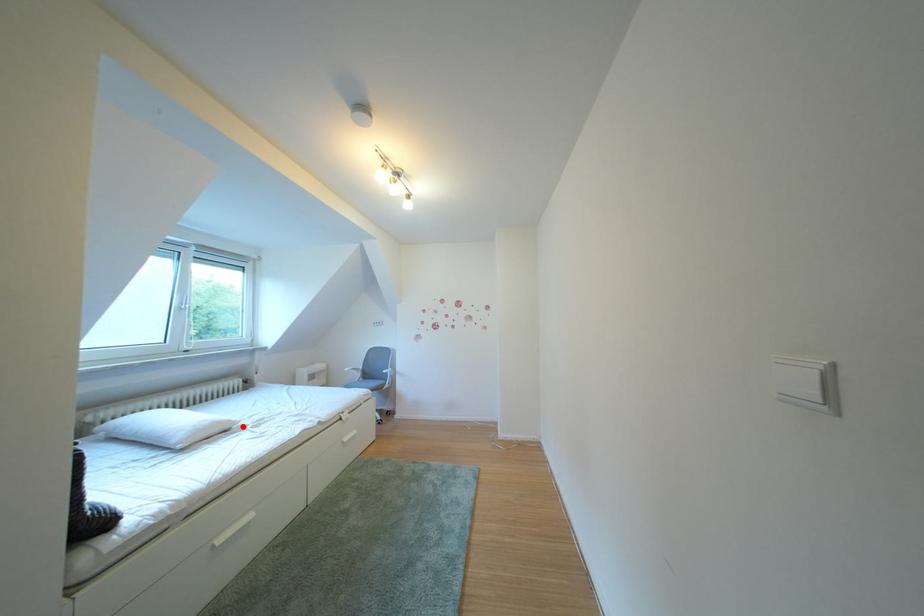
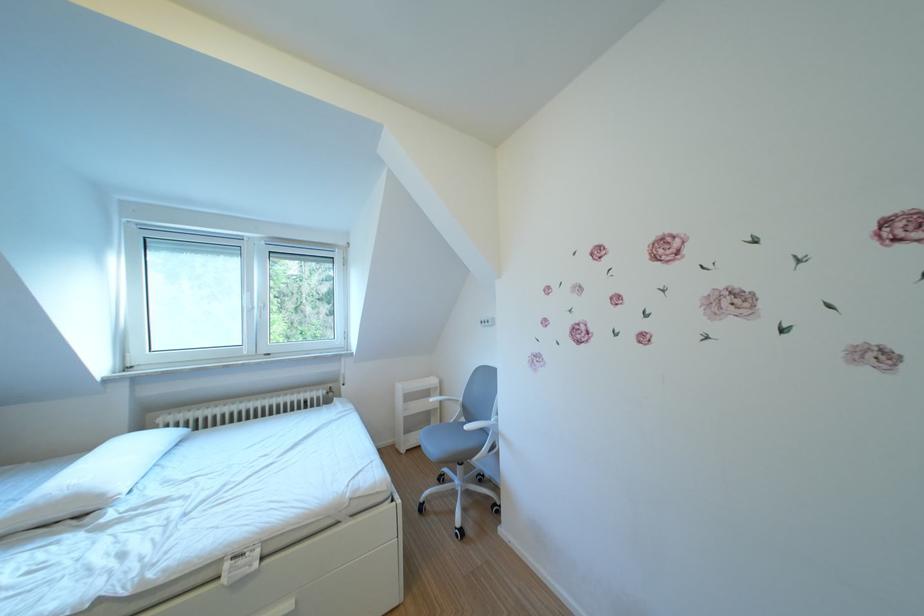
The point at the highlighted location is marked in the first image. Where is the corresponding point in the second image?

(115, 501)